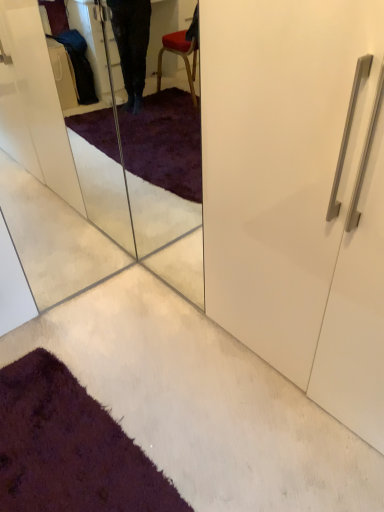
Locate an element on the screen. This screenshot has height=512, width=384. transparent glass door at lower left is located at coordinates (103, 168).

Measure the distance between point (12, 73) and camera.

The distance of point (12, 73) from camera is 2.23 meters.

Describe the element at coordinates (103, 168) in the screenshot. This screenshot has width=384, height=512. I see `transparent glass door at lower left` at that location.

Where is `transparent glass door at lower left`? transparent glass door at lower left is located at coordinates (103, 168).